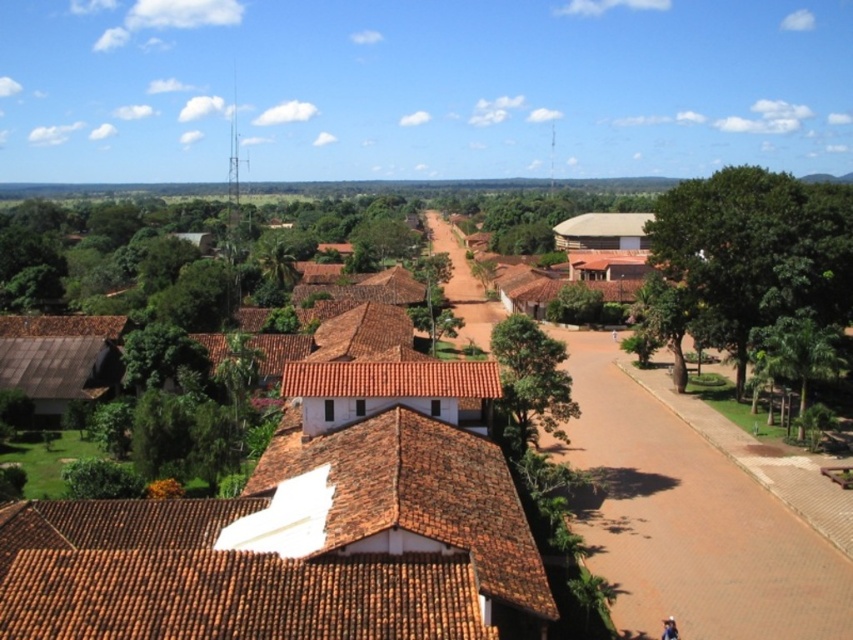
You are a tourist standing at the edge of the road in the rural area. You notice the brown tile roof at center and the green leafy tree at center. Which object appears bigger in the scene?

The brown tile roof at center appears larger than the green leafy tree at center in the scene.

You are an architect planning to construct a new building in this rural area. You need to ensure that the new building does not block the view of the green leafy tree at right from the brown tile roof at center. Based on their sizes, which object should be placed closer to the viewer to maintain the view?

The brown tile roof at center has a smaller size compared to green leafy tree at right. To ensure the view of the green leafy tree at right remains visible from the brown tile roof at center, the smaller brown tile roof at center should be placed closer to the viewer. This way, even though it is smaller, its proximity will not obstruct the larger green leafy tree at right in the background.